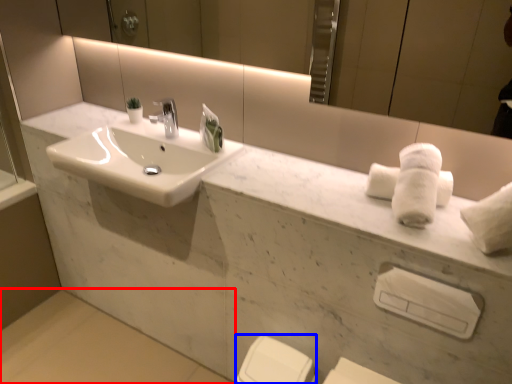
Question: Which point is further to the camera, concrete (highlighted by a red box) or porcelain (highlighted by a blue box)?

Choices:
 (A) concrete
 (B) porcelain

Answer: (A)